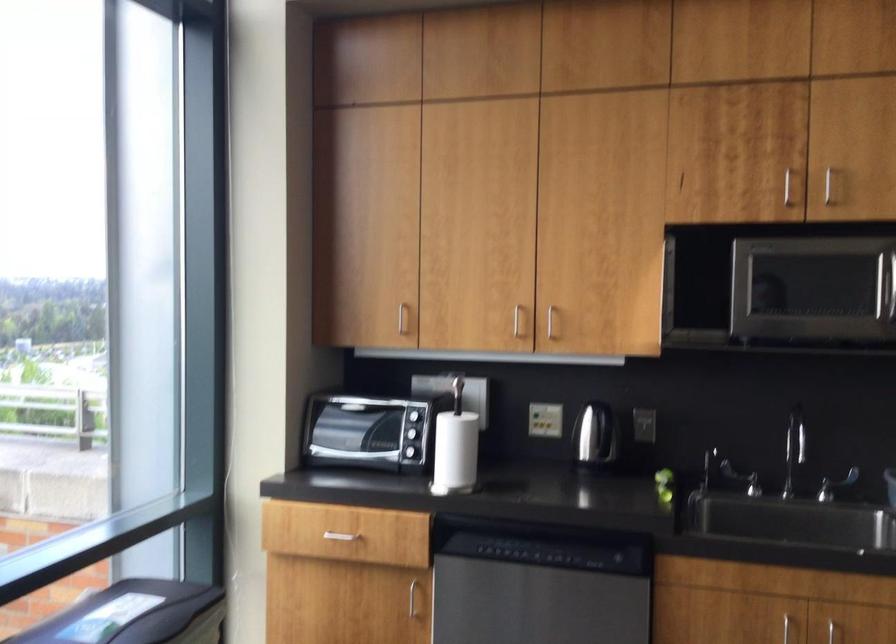
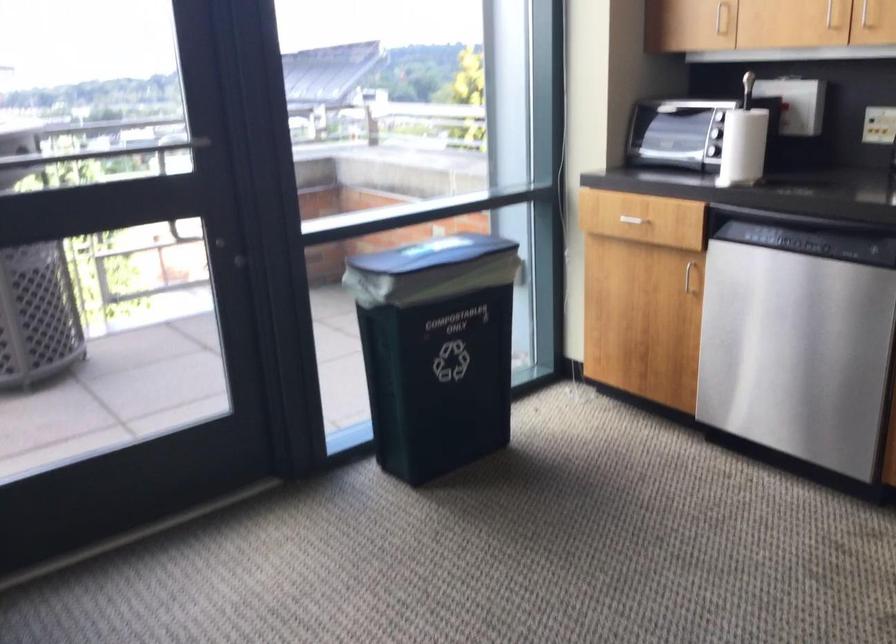
Find the pixel in the second image that matches (543,328) in the first image.

(865, 15)